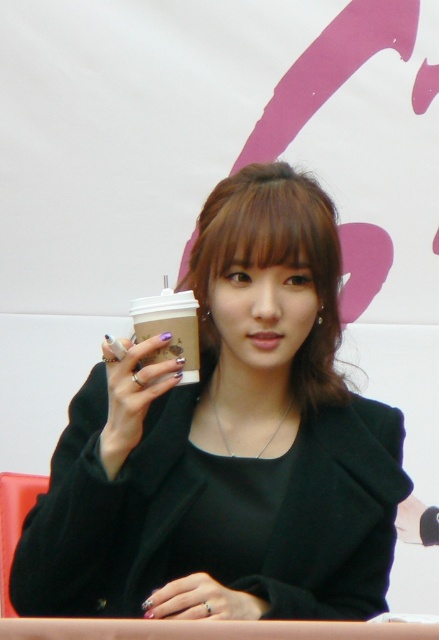
You are setting up a photo shoot and need to adjust the placement of the matte plastic cup at center and the white paper cup at center. According to the scene description, which cup should be placed lower to match the original image?

The matte plastic cup at center should be placed lower because it is located below the white paper cup at center in the original image.